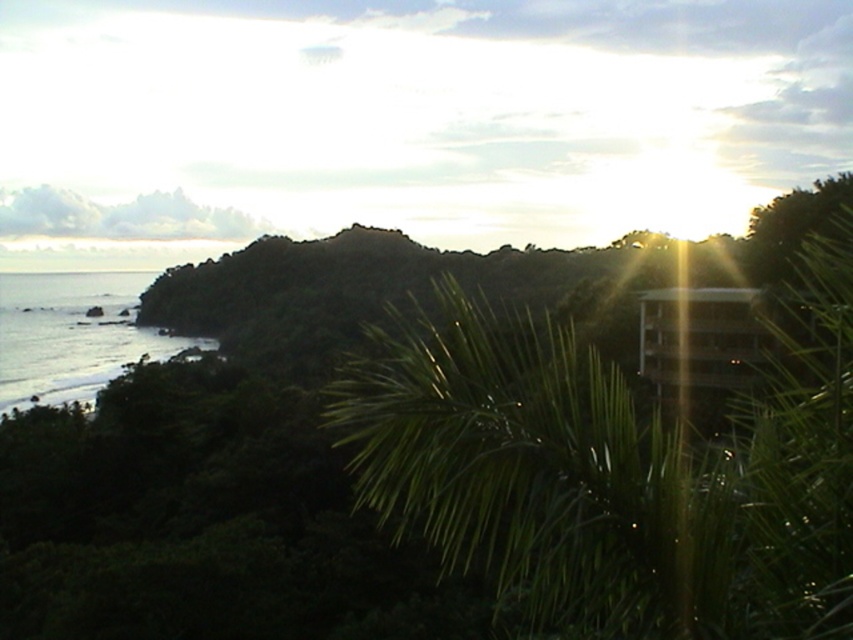
You are standing on the beach and want to take a photo that includes both the green leafy palm tree at center and the clear water at lower left. Which object should you position closer to the edge of the frame to ensure both fit in the shot?

Since the green leafy palm tree at center has a lesser width compared to clear water at lower left, you should position the green leafy palm tree at center closer to the edge of the frame to accommodate the wider clear water at lower left within the shot.

You are a hiker who wants to take a photo of the clear water at lower left while standing near the green leafy palm tree at center. Which object will appear larger in your photo?

The clear water at lower left will appear larger in your photo because the green leafy palm tree at center has a smaller size compared to clear water at lower left.